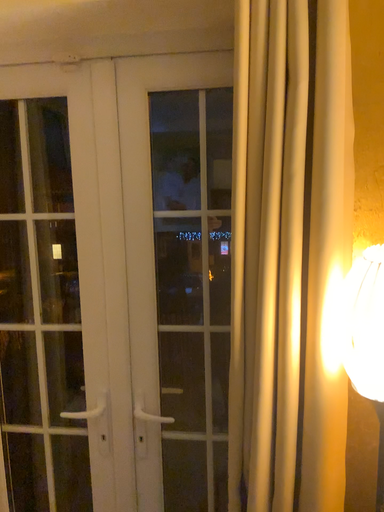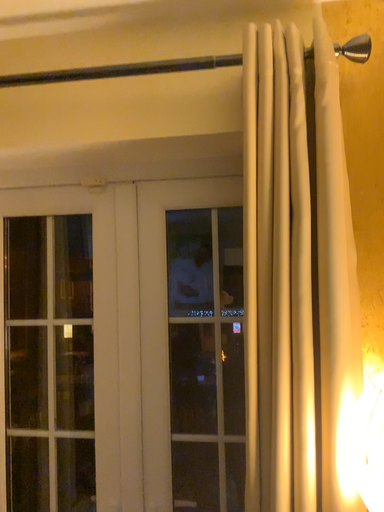
Question: How did the camera likely rotate when shooting the video?

Choices:
 (A) rotated upward
 (B) rotated downward

Answer: (A)